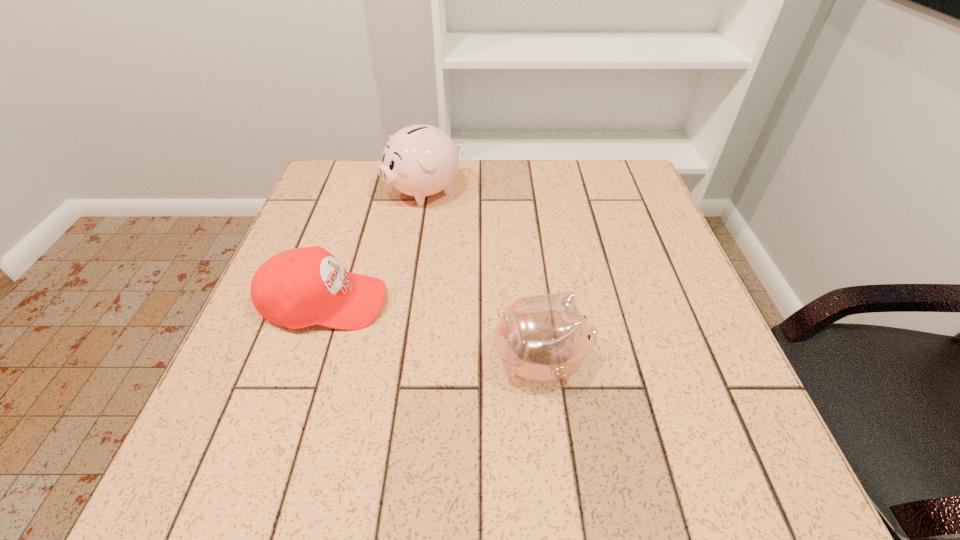
You are a GUI agent. You are given a task and a screenshot of the screen. Output one action in this format:
    pyautogui.click(x=<x>, y=<y>)
    Task: Click on the blank space at the far edge of the desktop
    
    Given the screenshot: What is the action you would take?
    pyautogui.click(x=408, y=195)

Locate an element on the screen. free space at the near edge is located at coordinates click(505, 464).

At what (x,y) coordinates should I click in order to perform the action: click on vacant space at the left edge of the desktop. Please return your answer as a coordinate pair (x, y). The width and height of the screenshot is (960, 540). Looking at the image, I should click on (350, 231).

In the image, there is a desktop. At what (x,y) coordinates should I click in order to perform the action: click on blank space at the right edge. Please return your answer as a coordinate pair (x, y). The width and height of the screenshot is (960, 540). Looking at the image, I should click on (651, 294).

Locate an element on the screen. This screenshot has width=960, height=540. free region at the far left corner of the desktop is located at coordinates (372, 194).

Where is `free space at the far right corner of the desktop`? The width and height of the screenshot is (960, 540). free space at the far right corner of the desktop is located at coordinates (607, 177).

Where is `free space that is in between the baseball cap and the tallest object`? This screenshot has width=960, height=540. free space that is in between the baseball cap and the tallest object is located at coordinates (375, 247).

Find the location of a particular element. vacant space that is in between the rightmost object and the shortest object is located at coordinates (433, 333).

Locate an element on the screen. free space between the shorter piggy bank and the left piggy bank is located at coordinates (483, 277).

Locate an element on the screen. Image resolution: width=960 pixels, height=540 pixels. free spot between the farthest object and the second tallest object is located at coordinates (483, 277).